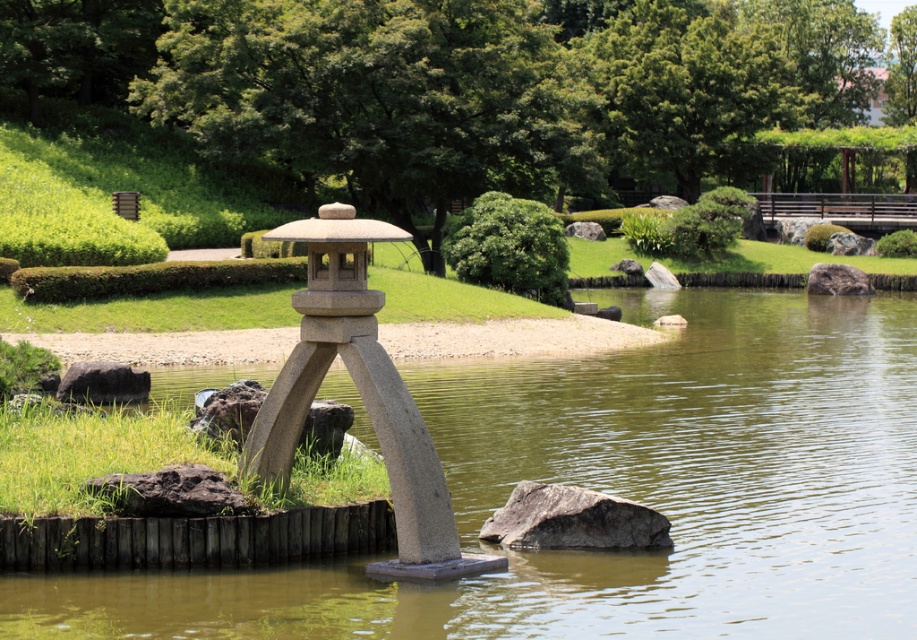
Question: Can you confirm if clear water at center is thinner than dark gray rock at lower left?

Choices:
 (A) yes
 (B) no

Answer: (B)

Question: Which object appears closest to the camera in this image?

Choices:
 (A) smooth stone lantern at center
 (B) gray rough rock at lower center
 (C) gray smooth rock at right
 (D) clear water at center

Answer: (D)

Question: Is smooth stone lantern at center wider than gray smooth rock at right?

Choices:
 (A) no
 (B) yes

Answer: (A)

Question: In this image, where is dark gray rock at lower left located relative to gray smooth rock at right?

Choices:
 (A) above
 (B) below

Answer: (B)

Question: Which object is the farthest from the clear water at center?

Choices:
 (A) gray smooth rock at right
 (B) dark gray rock at lower left
 (C) gray rough rock at lower center

Answer: (A)

Question: Which of these objects is positioned farthest from the dark gray rock at lower left?

Choices:
 (A) gray smooth rock at right
 (B) gray rough rock at lower center
 (C) clear water at center

Answer: (A)